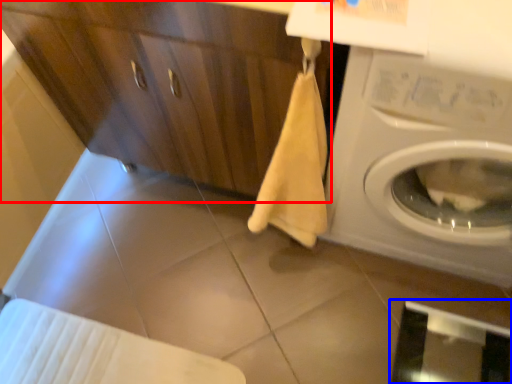
Question: Among these objects, which one is nearest to the camera, dresser (highlighted by a red box) or screen door (highlighted by a blue box)?

Choices:
 (A) dresser
 (B) screen door

Answer: (A)